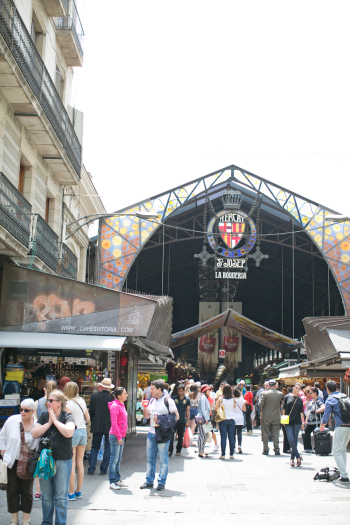
Locate an element on the screen. This screenshot has height=525, width=350. bar is located at coordinates (59, 372).